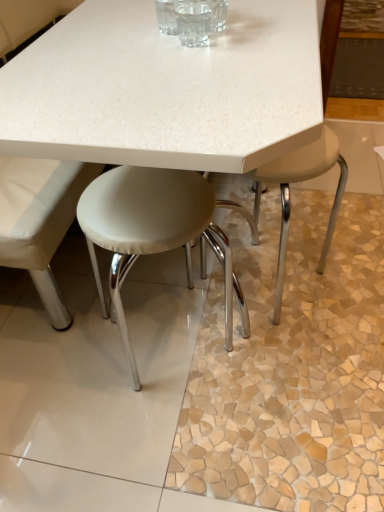
Image resolution: width=384 pixels, height=512 pixels. What are the coordinates of `free spot behind beige leather stool at lower right, arranged as the first stool when viewed from the right` in the screenshot? It's located at (294, 247).